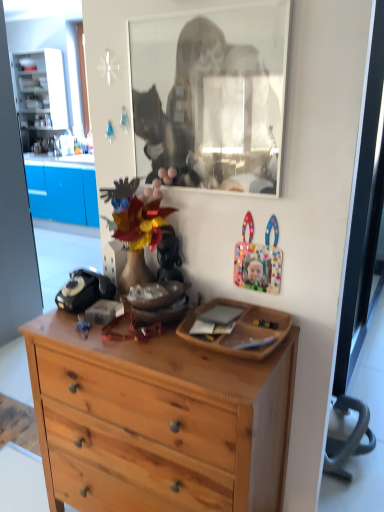
Question: Is wooden tray at center closer to the viewer compared to natural wood dresser at center?

Choices:
 (A) no
 (B) yes

Answer: (A)

Question: Is wooden tray at center turned away from natural wood dresser at center?

Choices:
 (A) no
 (B) yes

Answer: (A)

Question: Is wooden tray at center directly adjacent to natural wood dresser at center?

Choices:
 (A) no
 (B) yes

Answer: (A)

Question: Considering the relative sizes of wooden tray at center and natural wood dresser at center in the image provided, is wooden tray at center thinner than natural wood dresser at center?

Choices:
 (A) no
 (B) yes

Answer: (B)

Question: From the image's perspective, is wooden tray at center located above natural wood dresser at center?

Choices:
 (A) yes
 (B) no

Answer: (A)

Question: From a real-world perspective, is wooden tray at center on natural wood dresser at center?

Choices:
 (A) yes
 (B) no

Answer: (A)

Question: Considering the relative sizes of matte plastic mask at center and wooden tray at center in the image provided, is matte plastic mask at center bigger than wooden tray at center?

Choices:
 (A) yes
 (B) no

Answer: (B)

Question: From the image's perspective, is matte plastic mask at center above wooden tray at center?

Choices:
 (A) no
 (B) yes

Answer: (B)

Question: Considering the relative sizes of matte plastic mask at center and wooden tray at center in the image provided, is matte plastic mask at center thinner than wooden tray at center?

Choices:
 (A) no
 (B) yes

Answer: (B)

Question: From a real-world perspective, is matte plastic mask at center positioned under wooden tray at center based on gravity?

Choices:
 (A) yes
 (B) no

Answer: (B)

Question: Is matte plastic mask at center not within wooden tray at center?

Choices:
 (A) yes
 (B) no

Answer: (A)

Question: Is matte plastic mask at center facing away from wooden tray at center?

Choices:
 (A) no
 (B) yes

Answer: (A)

Question: Considering the relative sizes of natural wood dresser at center and black glass mirror at upper center in the image provided, is natural wood dresser at center shorter than black glass mirror at upper center?

Choices:
 (A) no
 (B) yes

Answer: (A)